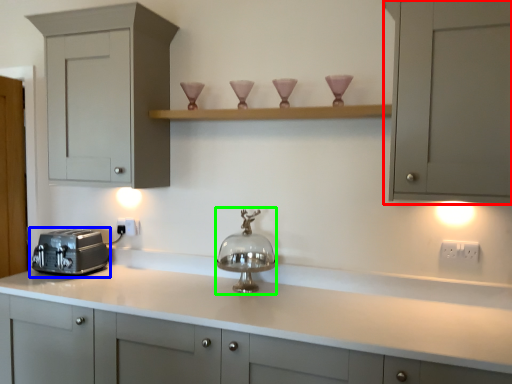
Question: Which object is positioned farthest from cabinetry (highlighted by a red box)? Select from toaster (highlighted by a blue box) and appliance (highlighted by a green box).

Choices:
 (A) toaster
 (B) appliance

Answer: (A)